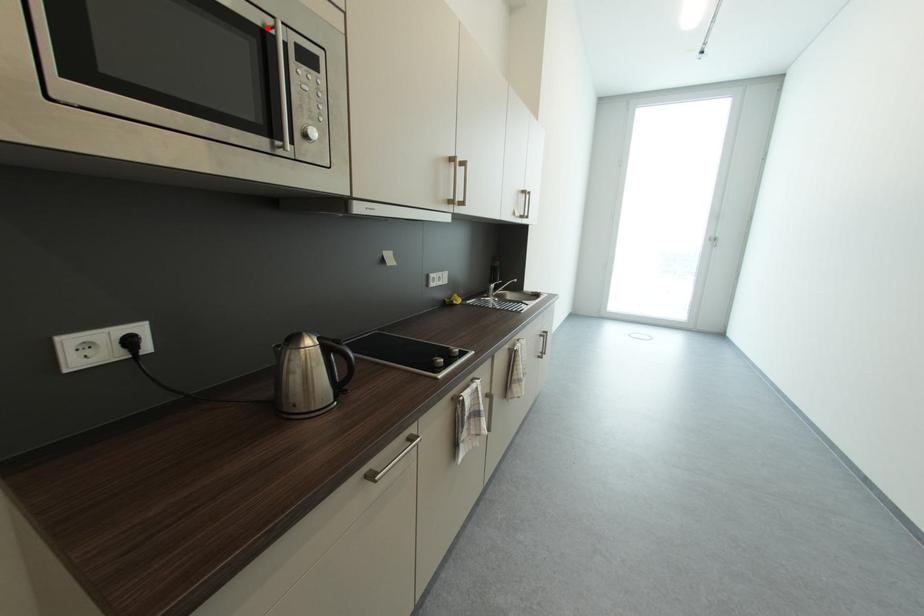
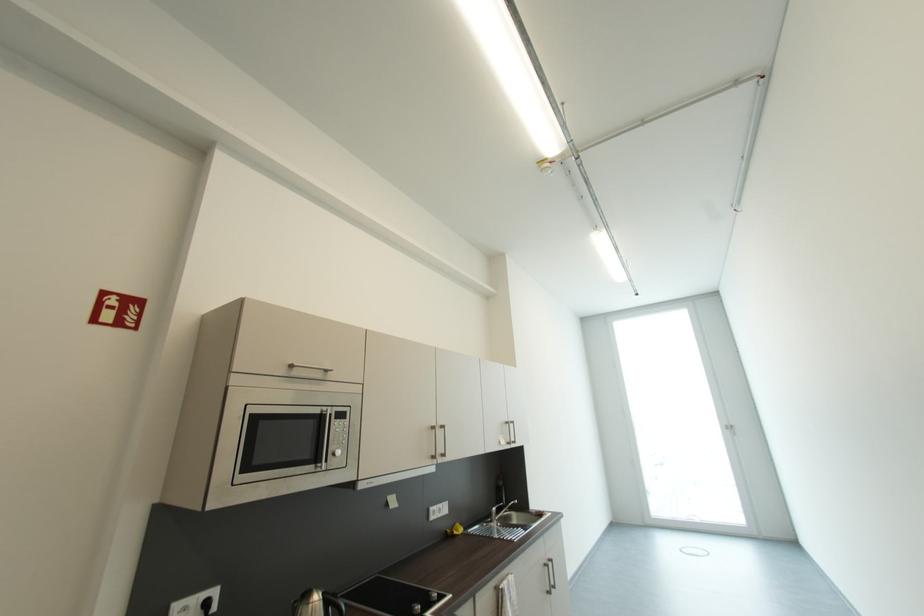
The point at the highlighted location is marked in the first image. Where is the corresponding point in the second image?

(325, 413)